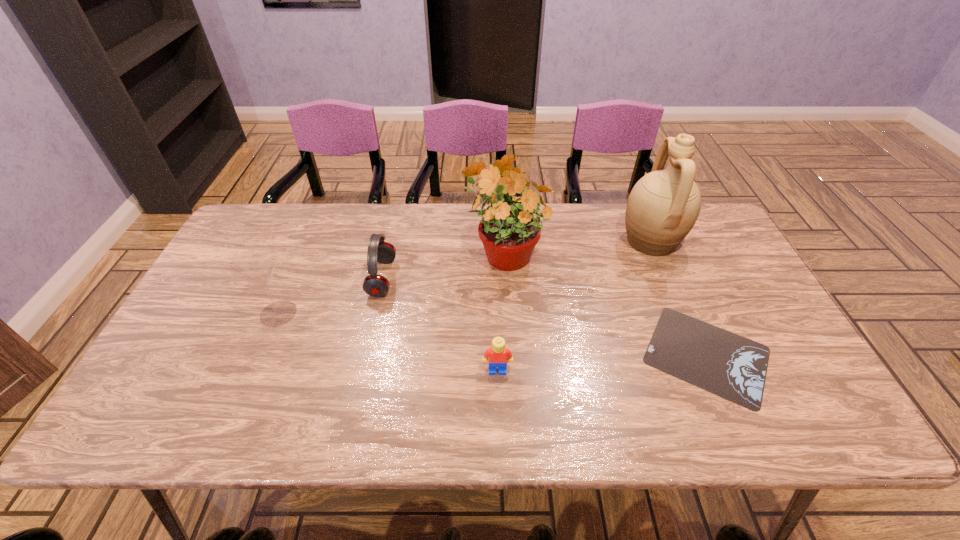
The width and height of the screenshot is (960, 540). I want to click on free region located on the right of the leftmost object, so click(x=351, y=313).

The height and width of the screenshot is (540, 960). Find the location of `vacant space located 0.350m on the ear cups of the second object from left to right`. vacant space located 0.350m on the ear cups of the second object from left to right is located at coordinates (516, 278).

Identify the location of vacant region located on the face of the fifth tallest object. (498, 395).

At what (x,y) coordinates should I click in order to perform the action: click on free spot located 0.280m on the back of the mousepad. Please return your answer as a coordinate pair (x, y). Looking at the image, I should click on (658, 241).

You are a GUI agent. You are given a task and a screenshot of the screen. Output one action in this format:
    pyautogui.click(x=<x>, y=<y>)
    Task: Click on the pitcher at the far edge
    This screenshot has height=540, width=960.
    Given the screenshot: What is the action you would take?
    click(663, 206)

At what (x,y) coordinates should I click in order to perform the action: click on flowerpot located at the far edge. Please return your answer as a coordinate pair (x, y). Image resolution: width=960 pixels, height=540 pixels. Looking at the image, I should click on (509, 231).

Locate an element on the screen. This screenshot has height=540, width=960. object situated at the near edge is located at coordinates (726, 364).

Locate an element on the screen. This screenshot has height=540, width=960. pitcher that is at the right edge is located at coordinates (663, 206).

Locate an element on the screen. This screenshot has width=960, height=540. mousepad situated at the right edge is located at coordinates (726, 364).

What are the coordinates of `object that is at the far right corner` in the screenshot? It's located at (663, 206).